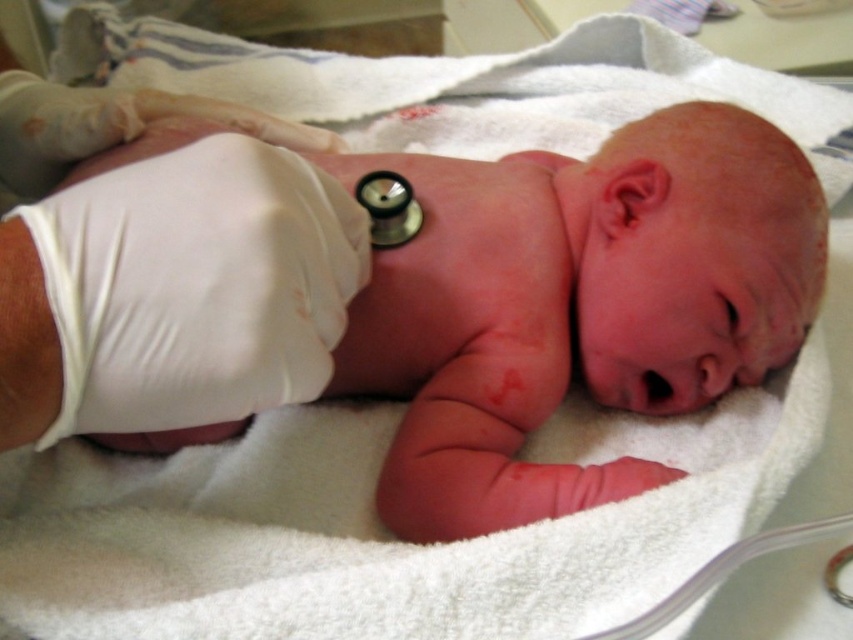
Between pink smooth skin at center and white latex glove at center, which one has more height?

With more height is pink smooth skin at center.

Measure the distance from pink smooth skin at center to white latex glove at center.

pink smooth skin at center and white latex glove at center are 7.72 inches apart from each other.

Between point (779, 353) and point (352, 198), which one is positioned behind?

The point (779, 353) is behind.

This screenshot has width=853, height=640. Identify the location of pink smooth skin at center. (575, 305).